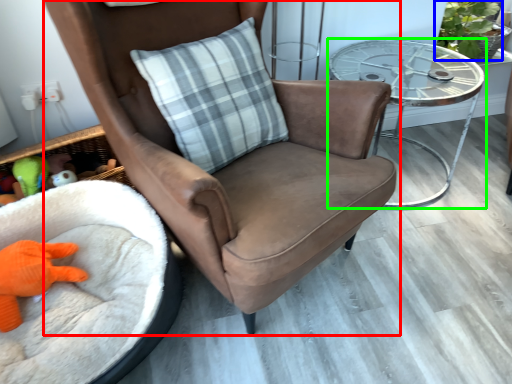
Question: Based on their relative distances, which object is farther from chair (highlighted by a red box)? Choose from plant (highlighted by a blue box) and table (highlighted by a green box).

Choices:
 (A) plant
 (B) table

Answer: (A)